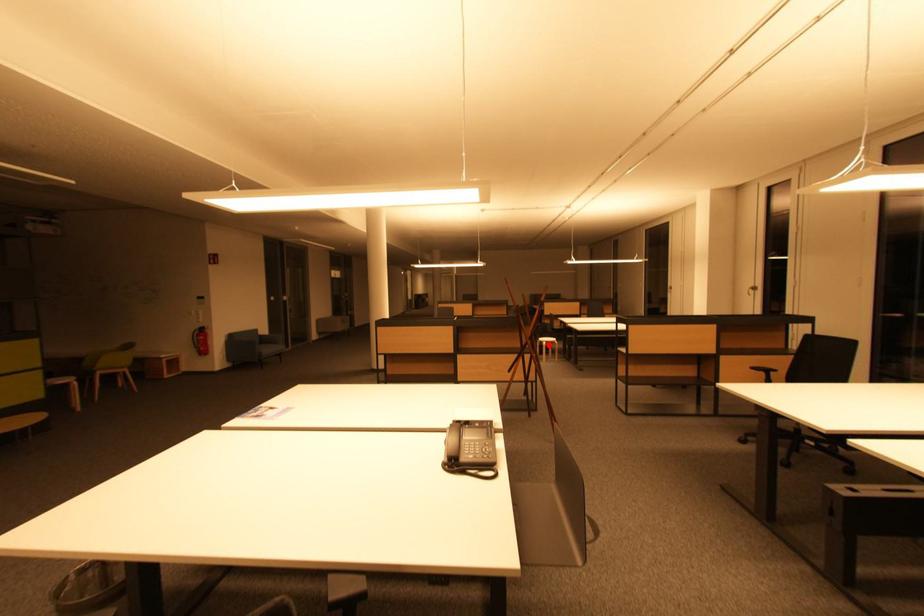
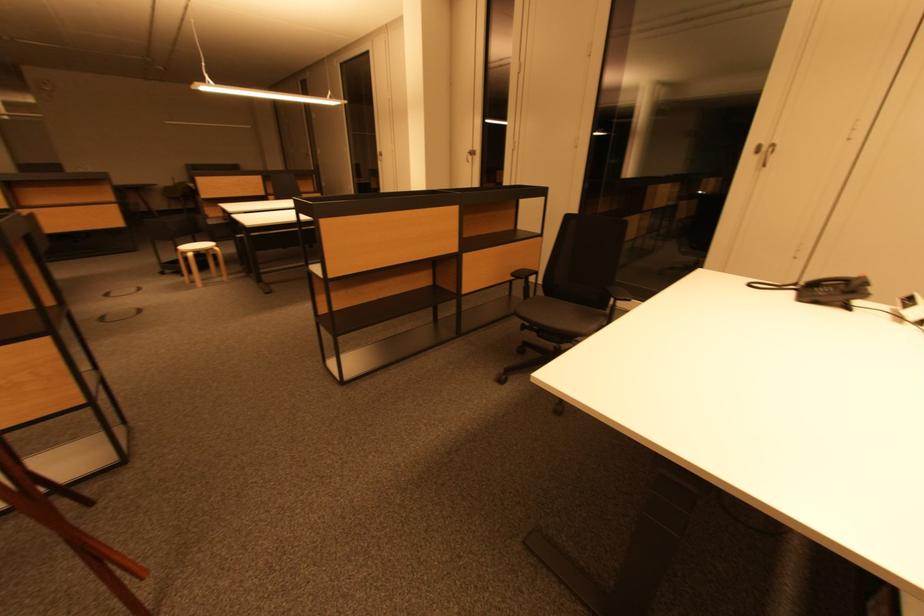
Question: A red point is marked in image1. In image2, is the corresponding 3D point closer to the camera or farther? Reply with the corresponding letter.

Choices:
 (A) The corresponding 3D point is closer.
 (B) The corresponding 3D point is farther.

Answer: (A)